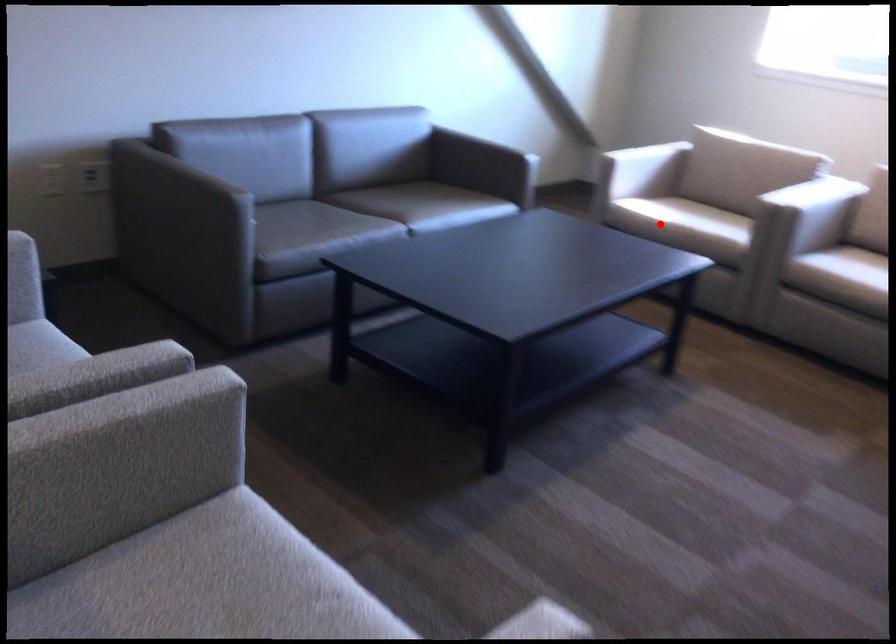
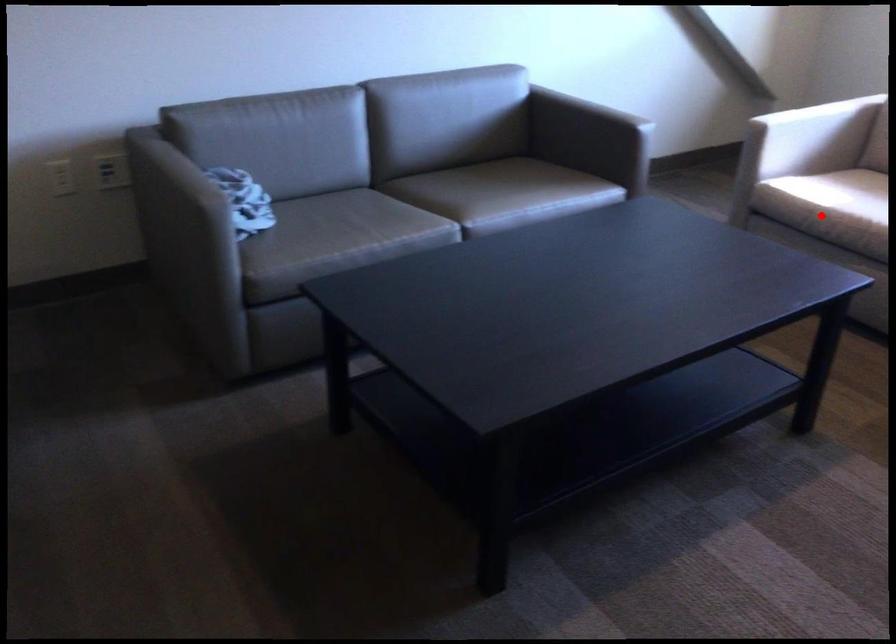
I am providing you with two images of the same scene from different viewpoints. A red point is marked on the first image and another point is marked on the second image. Is the red point in image1 aligned with the point shown in image2?

Yes